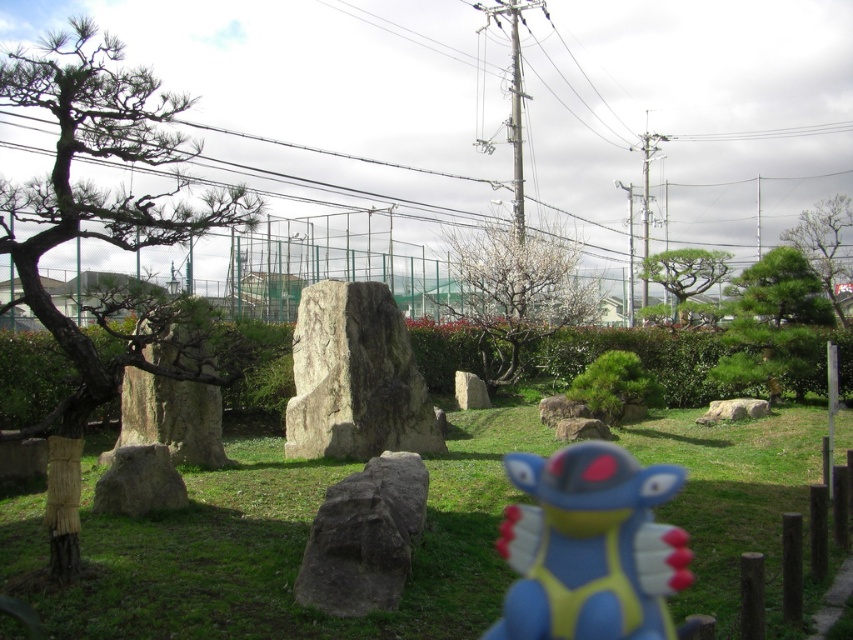
Question: Which point is farther from the camera taking this photo?

Choices:
 (A) (567, 476)
 (B) (345, 310)
 (C) (758, 353)

Answer: (C)

Question: Can you confirm if white textured tree at center is bigger than green leafy tree at upper right?

Choices:
 (A) no
 (B) yes

Answer: (A)

Question: Does green grass at center have a larger size compared to dark brown bark tree at left?

Choices:
 (A) yes
 (B) no

Answer: (A)

Question: Which object is farther from the camera taking this photo?

Choices:
 (A) natural stone monument at center
 (B) gray rough stone at center
 (C) white textured tree at center
 (D) green leafy tree at upper right

Answer: (D)

Question: Does natural stone monument at center appear on the left side of gray rough stone at center?

Choices:
 (A) yes
 (B) no

Answer: (A)

Question: Which point is farther from the camera taking this photo?

Choices:
 (A) (773, 396)
 (B) (534, 483)
 (C) (526, 275)
 (D) (421, 486)

Answer: (C)